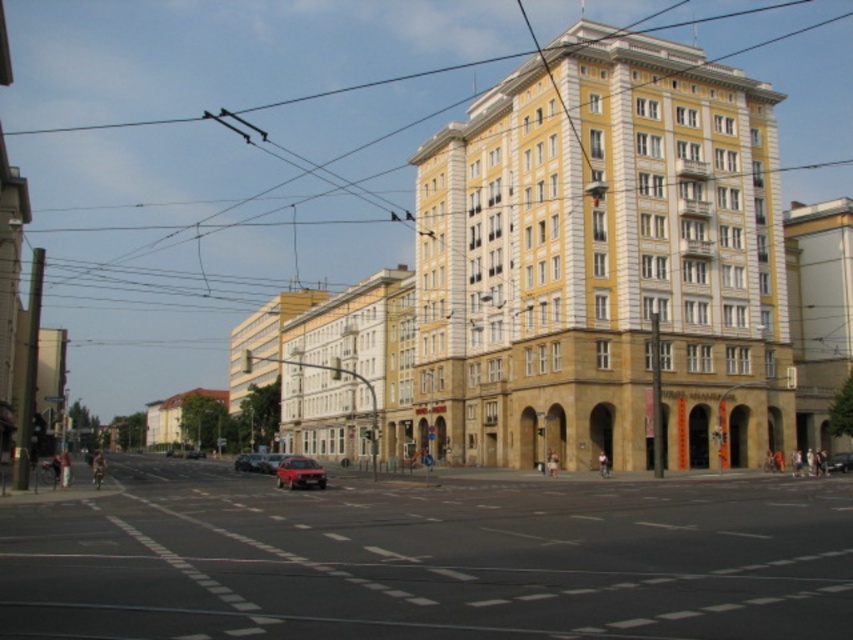
You are standing on the sidewalk in front of the large building and see both the metallic silver car at center and the shiny red car at center. Which car is nearer to you?

The metallic silver car at center is closer to the viewer than the shiny red car at center, so the metallic silver car at center is nearer to you.

You are a delivery driver who needs to park your truck in the parking lot near the large beige building. The parking lot has spaces marked for vehicles of different sizes. Your truck is as large as the red matte car at center. Can you safely park your truck in a space designated for vehicles the size of the metallic silver car at center?

The metallic silver car at center is smaller than the red matte car at center. Since your truck is as large as the red matte car at center, it would not fit in a space designated for vehicles the size of the metallic silver car at center. Please choose a larger parking space.